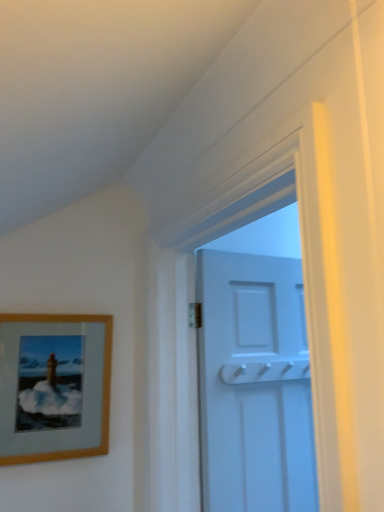
Question: Is wooden picture frame at left in front of white matte door at upper center?

Choices:
 (A) no
 (B) yes

Answer: (B)

Question: Does wooden picture frame at left appear on the left side of white matte door at upper center?

Choices:
 (A) no
 (B) yes

Answer: (B)

Question: From the image's perspective, is wooden picture frame at left above white matte door at upper center?

Choices:
 (A) no
 (B) yes

Answer: (B)

Question: Is wooden picture frame at left bigger than white matte door at upper center?

Choices:
 (A) yes
 (B) no

Answer: (B)

Question: Is wooden picture frame at left positioned far away from white matte door at upper center?

Choices:
 (A) no
 (B) yes

Answer: (A)

Question: From the image's perspective, is wooden picture frame at left below white matte door at upper center?

Choices:
 (A) yes
 (B) no

Answer: (B)

Question: Considering the relative sizes of white matte door at upper center and wooden picture frame at left in the image provided, is white matte door at upper center bigger than wooden picture frame at left?

Choices:
 (A) no
 (B) yes

Answer: (B)

Question: Does white matte door at upper center have a lesser height compared to wooden picture frame at left?

Choices:
 (A) no
 (B) yes

Answer: (A)

Question: Are white matte door at upper center and wooden picture frame at left beside each other?

Choices:
 (A) no
 (B) yes

Answer: (A)

Question: Can you confirm if white matte door at upper center is thinner than wooden picture frame at left?

Choices:
 (A) yes
 (B) no

Answer: (B)

Question: Is white matte door at upper center located outside wooden picture frame at left?

Choices:
 (A) no
 (B) yes

Answer: (B)

Question: Does white matte door at upper center lie behind wooden picture frame at left?

Choices:
 (A) no
 (B) yes

Answer: (B)

Question: From their relative heights in the image, would you say wooden picture frame at left is taller or shorter than white matte door at upper center?

Choices:
 (A) short
 (B) tall

Answer: (A)